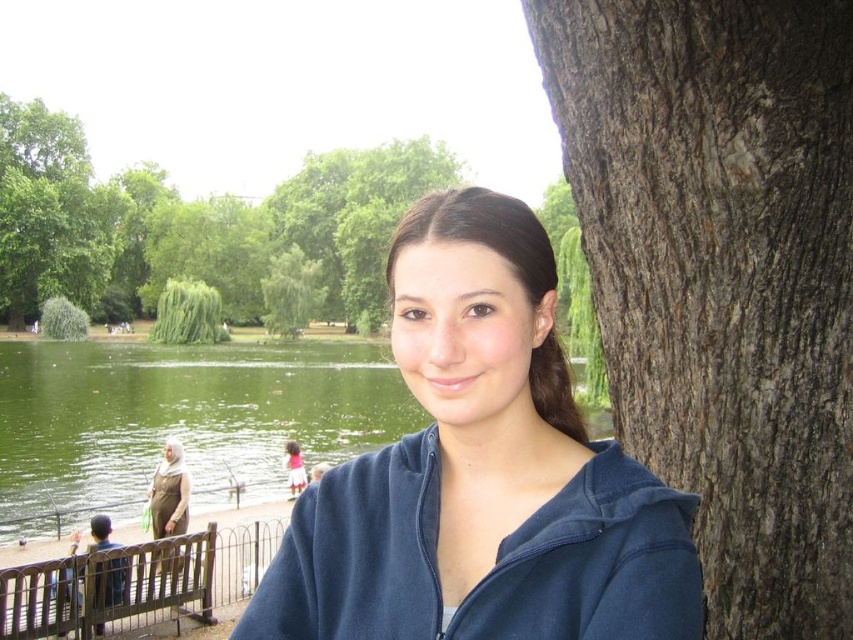
You are a photographer standing in the park and want to capture a photo that includes both the green liquid water at lower left and the pink fabric dress at lower center. Based on their heights, which object should be placed lower in the frame to ensure both are visible?

The pink fabric dress at lower center should be placed lower in the frame because the green liquid water at lower left has a greater height, allowing both objects to be visible in the photo.

You are standing in the park and want to take a photo of both the point at coordinates (509, 230) and the point at coordinates (169, 317). Which point should you focus on first to ensure both are in focus?

You should focus on the point at coordinates (509, 230) first because it is closer to the viewer than the point at coordinates (169, 317). This ensures both points will be in focus as the closer point sets the focal plane.